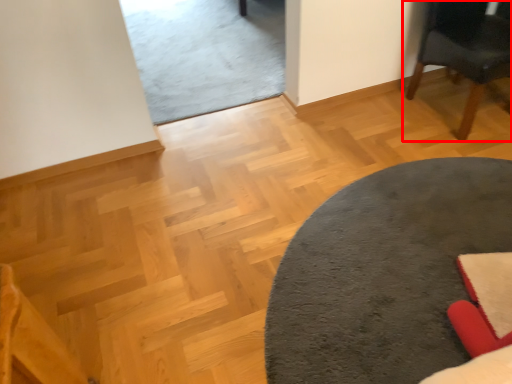
Question: From the image's perspective, considering the relative positions of chair (annotated by the red box) and table in the image provided, where is chair (annotated by the red box) located with respect to the staircase?

Choices:
 (A) below
 (B) above

Answer: (B)